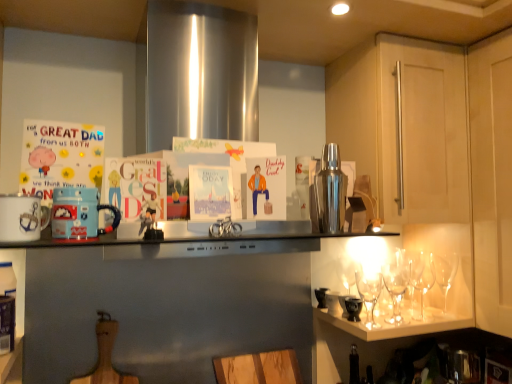
Question: Is white ceramic mug at left, the third appliance positioned from the right, wider or thinner than wooden cutting board at lower center?

Choices:
 (A) thin
 (B) wide

Answer: (B)

Question: In the image, is white ceramic mug at left, positioned as the 2th appliance in front-to-back order, positioned in front of or behind wooden cutting board at lower center?

Choices:
 (A) front
 (B) behind

Answer: (A)

Question: Which is farther from the shiny metallic cocktail shaker at upper right, the first appliance when ordered from right to left?

Choices:
 (A) matte blue mug at left, which is the first appliance in front-to-back order
 (B) clear glassware at lower right
 (C) light wood cabinet door at upper right, the first cabinetry from the back
 (D) white ceramic mug at left, positioned as the 2th appliance in front-to-back order
 (E) matte cardboard postcard at left

Answer: (D)

Question: Which object is positioned closest to the matte cardboard postcard at left?

Choices:
 (A) shiny metallic cocktail shaker at upper right, the 3th appliance when ordered from front to back
 (B) clear glassware at lower right
 (C) matte blue mug at left, the second appliance positioned from the left
 (D) white ceramic mug at left, positioned as the 2th appliance in front-to-back order
 (E) light wood cabinet door at upper right, the first cabinetry from the back

Answer: (D)